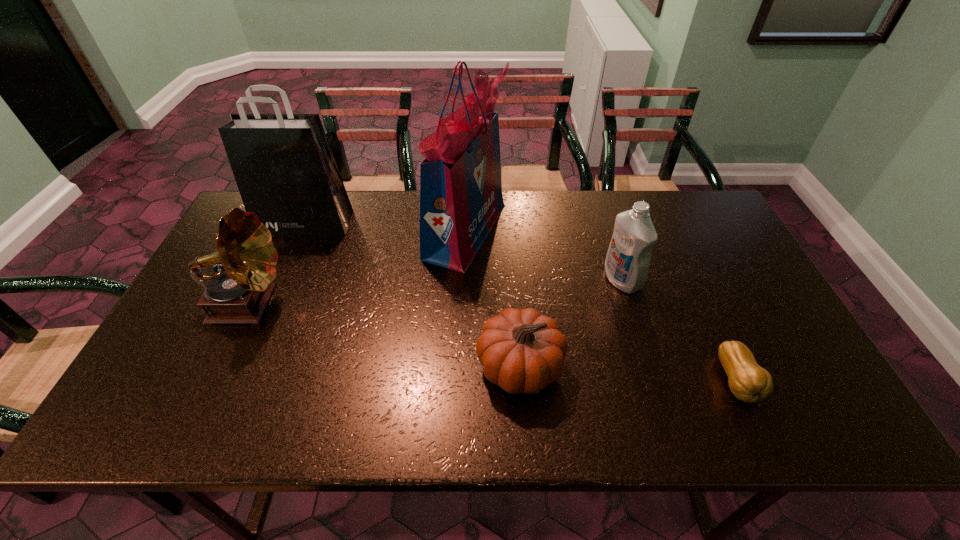
Find the location of `vacant space located on the left of the detergent`. vacant space located on the left of the detergent is located at coordinates (494, 280).

Identify the location of vacant area located on the face of the fifth tallest object. (443, 366).

You are a GUI agent. You are given a task and a screenshot of the screen. Output one action in this format:
    pyautogui.click(x=<x>, y=<y>)
    Task: Click on the free space located on the face of the fifth tallest object
    This screenshot has width=960, height=540.
    Given the screenshot: What is the action you would take?
    pyautogui.click(x=333, y=366)

Find the location of a particular element. vacant space located on the face of the fifth tallest object is located at coordinates (375, 366).

Where is `grocery bag that is at the far edge`? This screenshot has width=960, height=540. grocery bag that is at the far edge is located at coordinates (461, 198).

Where is `shopping bag located in the far edge section of the desktop`? The width and height of the screenshot is (960, 540). shopping bag located in the far edge section of the desktop is located at coordinates (283, 165).

I want to click on pumpkin located at the near edge, so pos(522,351).

At what (x,y) coordinates should I click in order to perform the action: click on gourd that is at the near edge. Please return your answer as a coordinate pair (x, y). Looking at the image, I should click on (749, 382).

Where is `shopping bag that is at the left edge`? shopping bag that is at the left edge is located at coordinates (283, 165).

The width and height of the screenshot is (960, 540). Find the location of `phonograph_record that is at the left edge`. phonograph_record that is at the left edge is located at coordinates (246, 259).